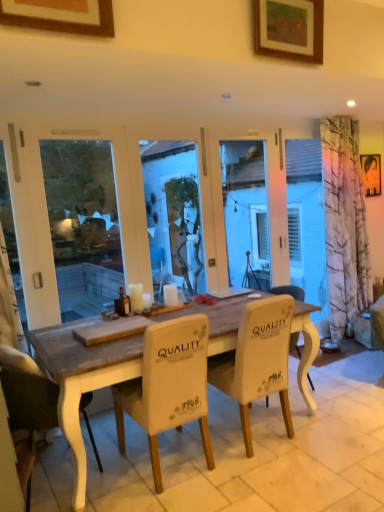
Find the location of `free spot below white fabric chair at center, the 2th chair when ordered from right to left (from a real-world perspective)`. free spot below white fabric chair at center, the 2th chair when ordered from right to left (from a real-world perspective) is located at coordinates (167, 466).